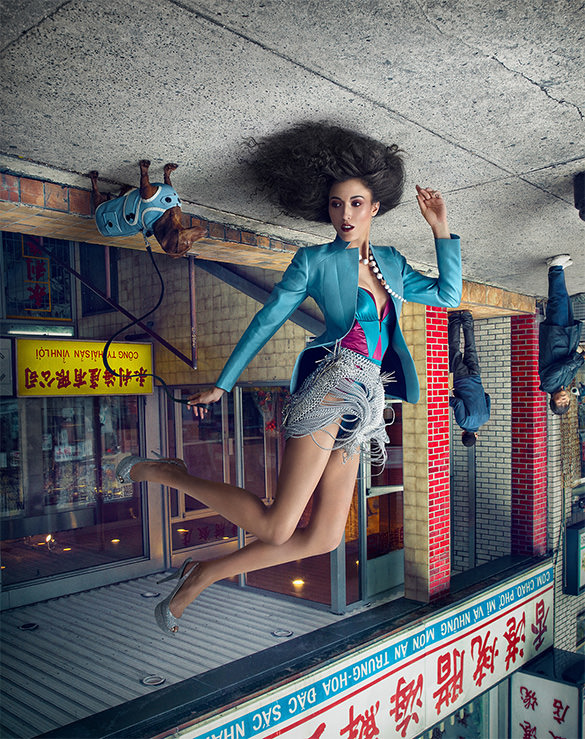
Where is `potlight`? potlight is located at coordinates (153, 683), (284, 632), (154, 596), (27, 627).